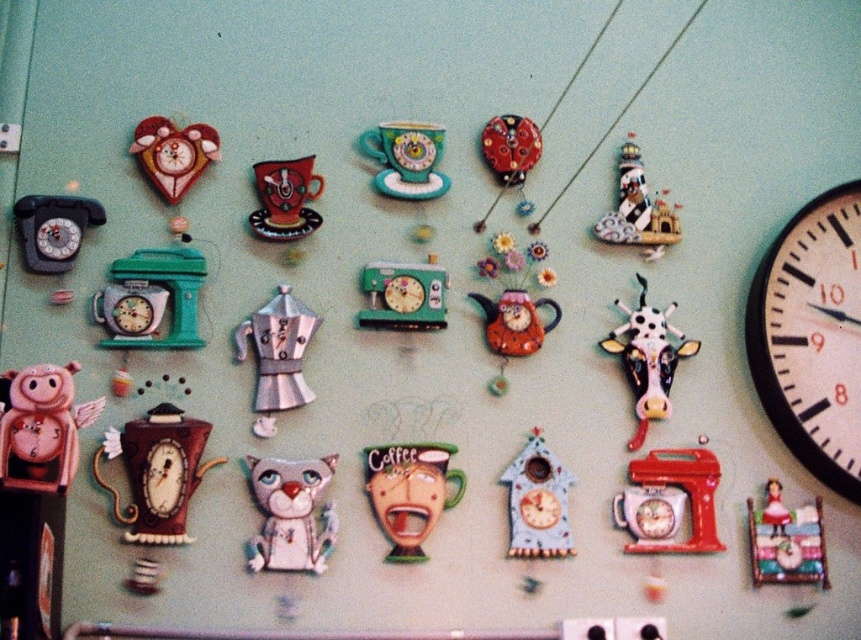
Question: In this image, where is brushed metal coffee pot at center located relative to matte red heart at upper left?

Choices:
 (A) below
 (B) above

Answer: (A)

Question: Is white plastic clock at right bigger than matte orange teapot at center?

Choices:
 (A) no
 (B) yes

Answer: (B)

Question: Which point appears closest to the camera in this image?

Choices:
 (A) 648,308
 (B) 620,208
 (C) 129,424

Answer: (C)

Question: Can you confirm if red matte mixer at center-right is positioned to the right of matte green cup at center?

Choices:
 (A) yes
 (B) no

Answer: (A)

Question: Which point is farther from the camera taking this photo?

Choices:
 (A) (153, 172)
 (B) (416, 154)
 (C) (618, 180)
 (D) (759, 522)

Answer: (C)

Question: Which point is farther to the camera?

Choices:
 (A) matte pink doll at lower right
 (B) matte ceramic teacup at upper center

Answer: (A)